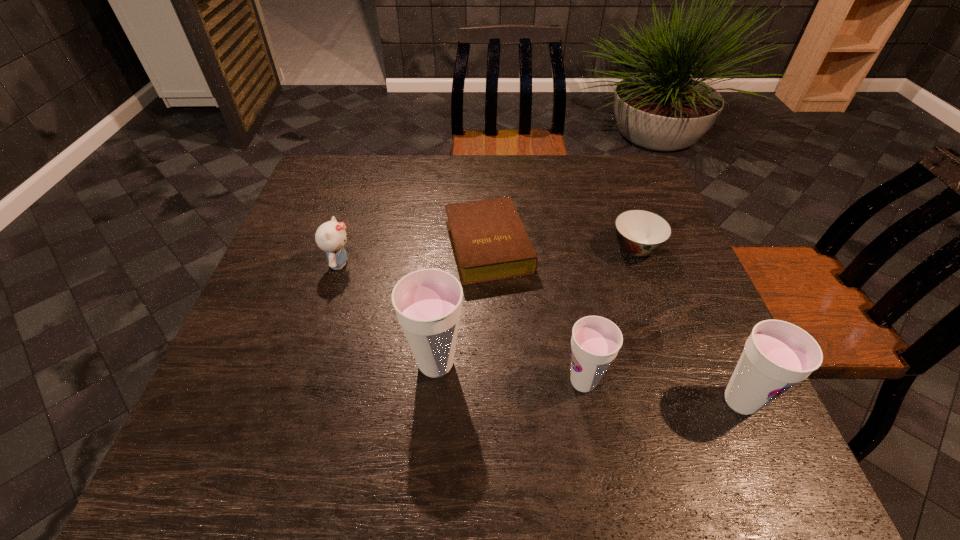
Where is `free point between the shortest object and the second shortest cup`? This screenshot has width=960, height=540. free point between the shortest object and the second shortest cup is located at coordinates (614, 323).

This screenshot has width=960, height=540. I want to click on free space between the leftmost cup and the soup bowl, so click(x=536, y=306).

I want to click on empty location between the kitten and the shortest object, so click(414, 255).

Select which object appears as the third closest to the third tallest object. Please provide its 2D coordinates. Your answer should be formatted as a tuple, i.e. [(x, y)], where the tuple contains the x and y coordinates of a point satisfying the conditions above.

[(489, 242)]

Identify the location of object that stands as the third closest to the soup bowl. Image resolution: width=960 pixels, height=540 pixels. (777, 355).

Identify the location of cup that stands as the closest to the kitten. (428, 303).

Identify the location of the closest cup to the fifth shortest object. The image size is (960, 540). (595, 341).

This screenshot has width=960, height=540. Find the location of `free region that satisfies the following two spatial constraints: 1. on the front-facing side of the second tallest object; 2. on the right side of the leftmost object`. free region that satisfies the following two spatial constraints: 1. on the front-facing side of the second tallest object; 2. on the right side of the leftmost object is located at coordinates (297, 401).

I want to click on free point that satisfies the following two spatial constraints: 1. on the front side of the shortest object; 2. on the left side of the second shortest cup, so click(492, 401).

Find the location of `vacant position in the image that satisfies the following two spatial constraints: 1. on the front-facing side of the rightmost cup; 2. on the left side of the fourth tallest object`. vacant position in the image that satisfies the following two spatial constraints: 1. on the front-facing side of the rightmost cup; 2. on the left side of the fourth tallest object is located at coordinates (297, 401).